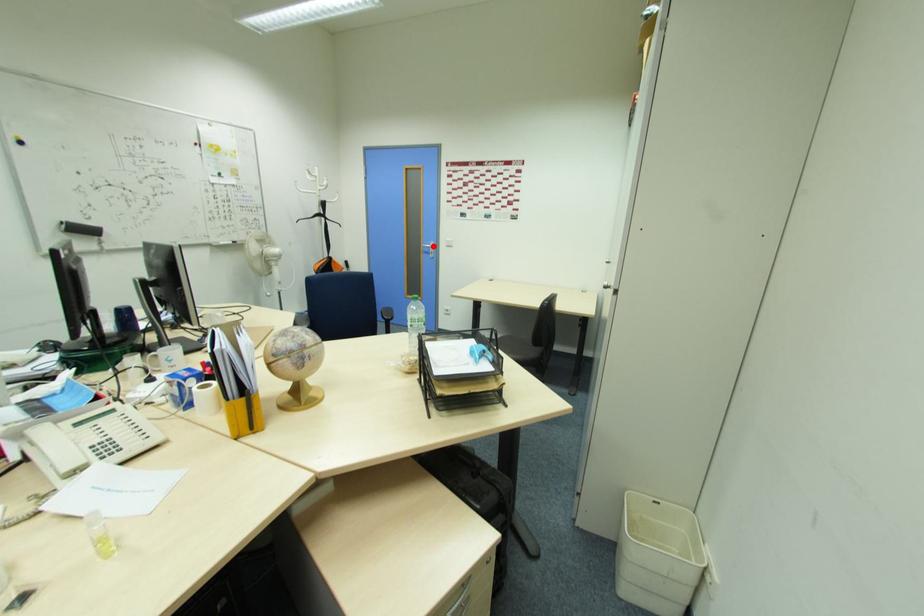
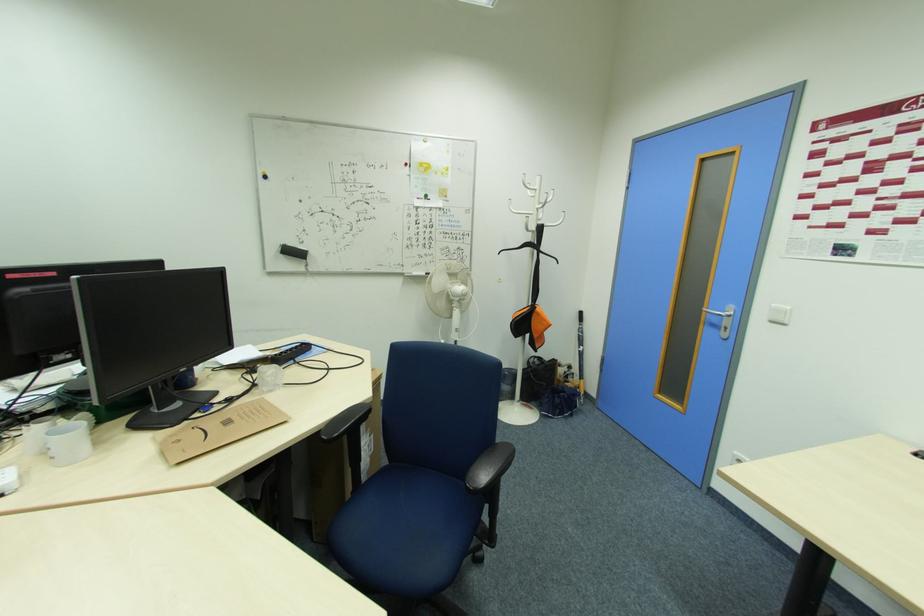
Where in the second image is the point corresponding to the highlighted location from the first image?

(727, 313)